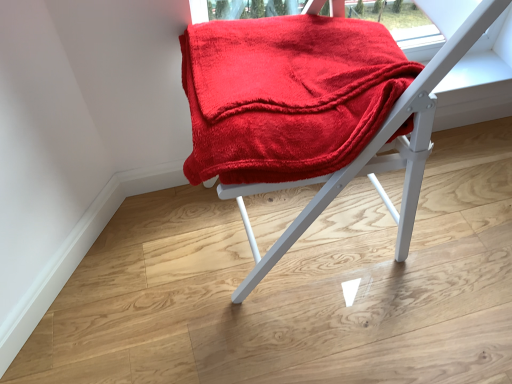
Identify the location of vacant space in fuzzy red blanket at center (from a real-world perspective). The image size is (512, 384). (300, 238).